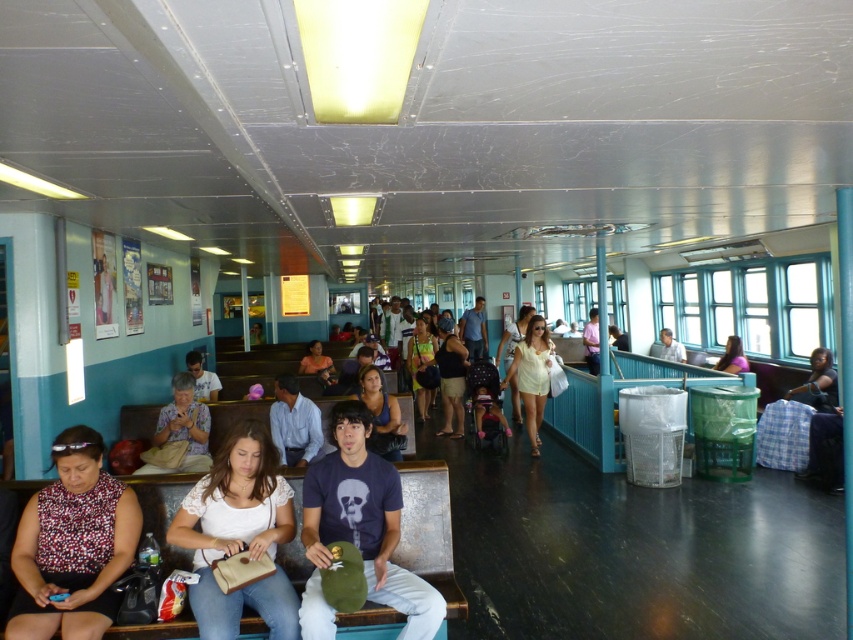
Question: Which object is farther from the camera taking this photo?

Choices:
 (A) pink fabric shirt at upper right
 (B) white matte dress at center
 (C) white fabric purse at center

Answer: (A)

Question: Is white fabric purse at center bigger than matte black t-shirt at center?

Choices:
 (A) no
 (B) yes

Answer: (A)

Question: Where is matte black t-shirt at center located in relation to white matte dress at center in the image?

Choices:
 (A) right
 (B) left

Answer: (B)

Question: Does white fabric purse at center appear under pink fabric shirt at upper right?

Choices:
 (A) no
 (B) yes

Answer: (B)

Question: Which of the following is the closest to the observer?

Choices:
 (A) (726, 352)
 (B) (239, 486)
 (C) (518, 387)

Answer: (B)

Question: Which point is farther to the camera?

Choices:
 (A) (524, 337)
 (B) (347, 540)

Answer: (A)